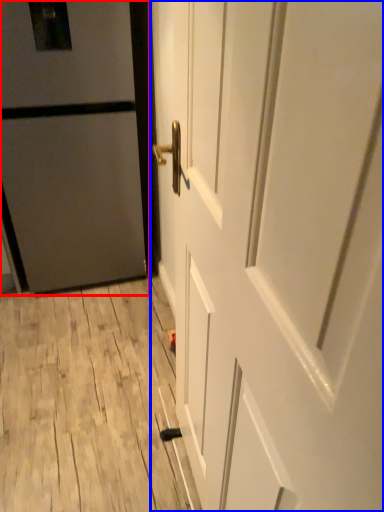
Question: Which object is further to the camera taking this photo, door (highlighted by a red box) or door (highlighted by a blue box)?

Choices:
 (A) door
 (B) door

Answer: (A)